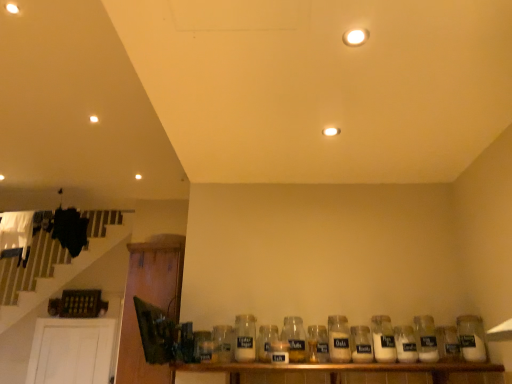
Question: Considering the relative positions of white glass bottle at center, which is counted as the 3th bottle, starting from the right, and white glass jar at center, positioned as the 4th bottle in right-to-left order, in the image provided, is white glass bottle at center, which is counted as the 3th bottle, starting from the right, to the right of white glass jar at center, positioned as the 4th bottle in right-to-left order, from the viewer's perspective?

Choices:
 (A) yes
 (B) no

Answer: (A)

Question: Does white glass bottle at center, which is counted as the 3th bottle, starting from the right, have a larger size compared to white glass jar at center, which is the 8th bottle in left-to-right order?

Choices:
 (A) no
 (B) yes

Answer: (A)

Question: Is white glass bottle at center, the ninth bottle positioned from the left, turned away from white glass jar at center, positioned as the 4th bottle in right-to-left order?

Choices:
 (A) yes
 (B) no

Answer: (B)

Question: From the image's perspective, is white glass bottle at center, which is counted as the 3th bottle, starting from the right, above white glass jar at center, which is the 8th bottle in left-to-right order?

Choices:
 (A) no
 (B) yes

Answer: (A)

Question: Is white glass bottle at center, which is counted as the 3th bottle, starting from the right, completely or partially outside of white glass jar at center, positioned as the 4th bottle in right-to-left order?

Choices:
 (A) yes
 (B) no

Answer: (A)

Question: Is white glass bottle at center, which is counted as the 3th bottle, starting from the right, positioned in front of white glass jar at center, positioned as the 4th bottle in right-to-left order?

Choices:
 (A) no
 (B) yes

Answer: (A)

Question: Can you confirm if white glass jar at center, the sixth bottle from the right, is wider than clear glass jar at center, which is the 3th bottle from left to right?

Choices:
 (A) yes
 (B) no

Answer: (B)

Question: Is clear glass jar at center, which is the 3th bottle from left to right, inside white glass jar at center, which is counted as the sixth bottle, starting from the left?

Choices:
 (A) no
 (B) yes

Answer: (A)

Question: Can you confirm if white glass jar at center, which is counted as the sixth bottle, starting from the left, is thinner than clear glass jar at center, which is the 3th bottle from left to right?

Choices:
 (A) yes
 (B) no

Answer: (A)

Question: From the image's perspective, does white glass jar at center, the sixth bottle from the right, appear higher than clear glass jar at center, arranged as the ninth bottle when viewed from the right?

Choices:
 (A) no
 (B) yes

Answer: (B)

Question: Is white glass jar at center, the sixth bottle from the right, far from clear glass jar at center, arranged as the ninth bottle when viewed from the right?

Choices:
 (A) yes
 (B) no

Answer: (B)

Question: Does white glass jar at center, the sixth bottle from the right, turn towards clear glass jar at center, arranged as the ninth bottle when viewed from the right?

Choices:
 (A) no
 (B) yes

Answer: (A)

Question: From the image's perspective, is white glass jar at center, positioned as the 4th bottle in right-to-left order, below wooden shelf at lower center?

Choices:
 (A) yes
 (B) no

Answer: (B)